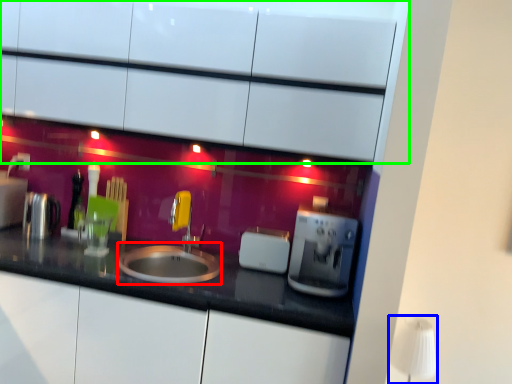
Question: Which is nearer to the sink (highlighted by a red box)? table lamp (highlighted by a blue box) or cabinetry (highlighted by a green box).

Choices:
 (A) table lamp
 (B) cabinetry

Answer: (B)